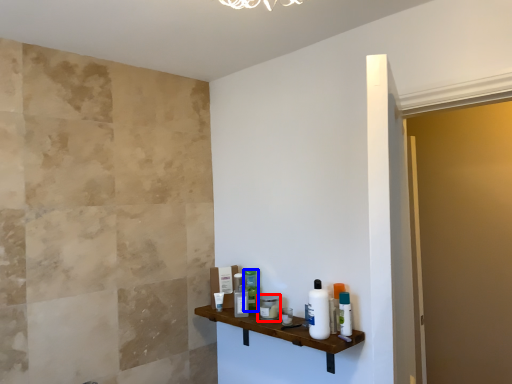
Question: Which of the following is the closest to the observer, toiletry (highlighted by a red box) or toiletry (highlighted by a blue box)?

Choices:
 (A) toiletry
 (B) toiletry

Answer: (A)